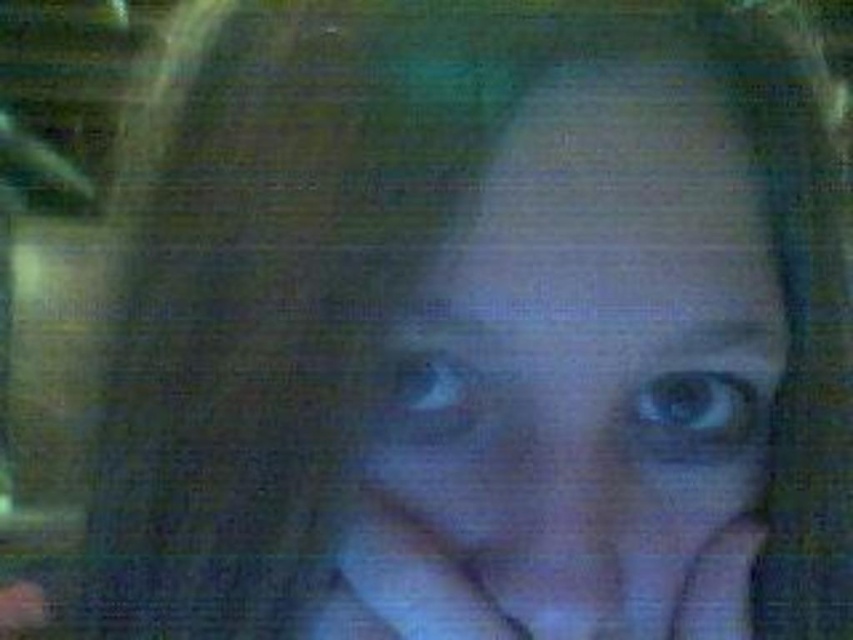
Which is more to the left, smooth skin face at center or matte skin hand at center?

matte skin hand at center

Can you confirm if smooth skin face at center is smaller than matte skin hand at center?

Actually, smooth skin face at center might be larger than matte skin hand at center.

The height and width of the screenshot is (640, 853). What do you see at coordinates (581, 384) in the screenshot?
I see `smooth skin face at center` at bounding box center [581, 384].

The image size is (853, 640). Find the location of `smooth skin face at center`. smooth skin face at center is located at coordinates pyautogui.click(x=581, y=384).